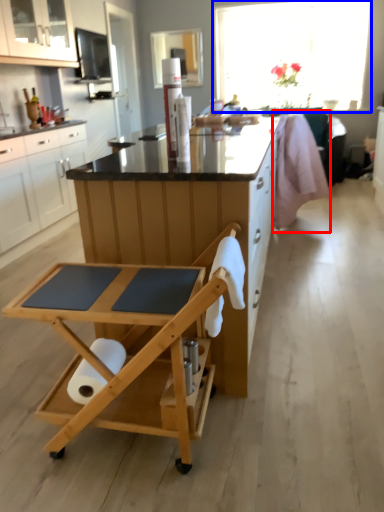
Question: Among these objects, which one is nearest to the camera, swivel chair (highlighted by a red box) or window (highlighted by a blue box)?

Choices:
 (A) swivel chair
 (B) window

Answer: (A)